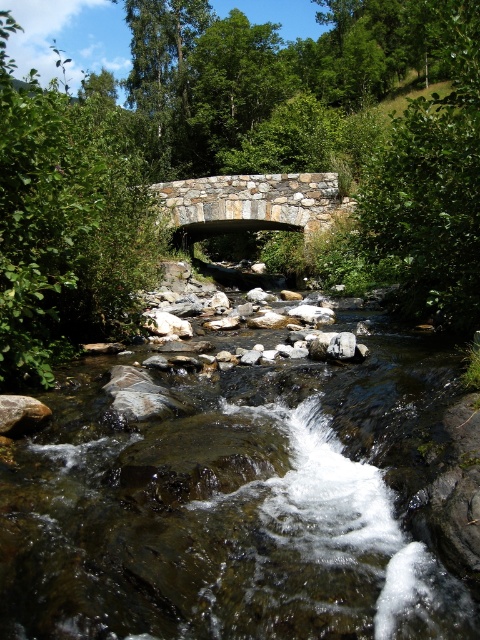
Image resolution: width=480 pixels, height=640 pixels. Find the location of `gray rock at lower left`. gray rock at lower left is located at coordinates coord(22,413).

Is gray rock at lower left to the left of smooth gray rock at center from the viewer's perspective?

Yes, gray rock at lower left is to the left of smooth gray rock at center.

Which is behind, point (36, 424) or point (339, 346)?

The point (339, 346) is behind.

Locate an element on the screen. gray rock at lower left is located at coordinates (22, 413).